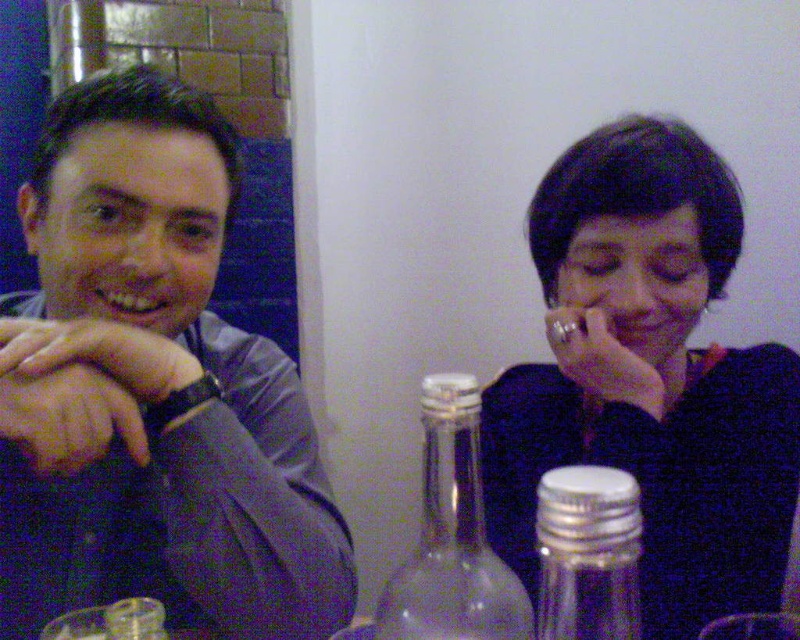
Looking at the scene, where is the dark blue sweater at upper right in relation to the clear glass bottle at center?

The dark blue sweater at upper right is located to the right of the clear glass bottle at center.

You are a server at a restaurant and need to place a new salt shaker that is the same size as the clear glass salt shaker at lower right. Can you confirm if the matte black wristwatch at left is too large to fit in the same space?

The clear glass salt shaker at lower right has a smaller size compared to matte black wristwatch at left, so the matte black wristwatch at left is too large to fit in the same space as the new salt shaker.